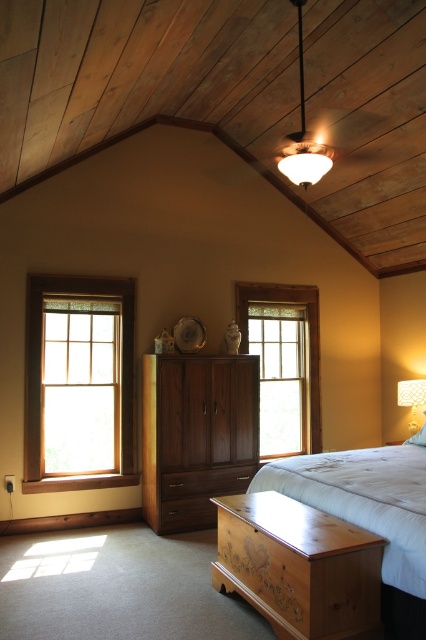
Which is more to the right, white matte bed at center or dark wood drawer at center?

From the viewer's perspective, white matte bed at center appears more on the right side.

Does white matte bed at center appear on the right side of dark wood drawer at center?

Yes, white matte bed at center is to the right of dark wood drawer at center.

Does point (412, 561) come farther from viewer compared to point (192, 525)?

That is False.

Locate an element on the screen. white matte bed at center is located at coordinates (371, 515).

Is point (51, 464) positioned after point (173, 397)?

Yes, it is.

Is light brown wooden window at left thinner than walnut wood cabinet at center?

No.

Is point (123, 326) positioned after point (241, 424)?

That is True.

The width and height of the screenshot is (426, 640). Find the location of `light brown wooden window at left`. light brown wooden window at left is located at coordinates (78, 381).

Does light brown wooden window at left come behind matte glass pendant light at upper center?

Yes, it is behind matte glass pendant light at upper center.

Can you confirm if light brown wooden window at left is taller than matte glass pendant light at upper center?

Correct, light brown wooden window at left is much taller as matte glass pendant light at upper center.

What are the coordinates of `light brown wooden window at left` in the screenshot? It's located at (78, 381).